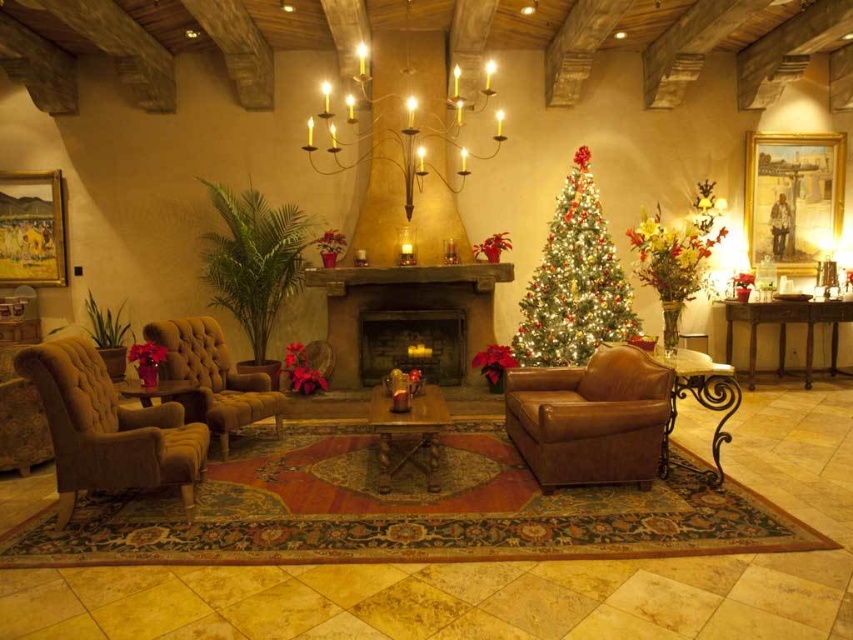
You are standing in the room and want to take a photo of the point at coordinates point (367, 352). The camera you are using has a maximum focus range of 6 meters. Will the camera be able to focus on the point?

The distance of point (367, 352) from camera is 6.62 meters, which exceeds the camera maximum focus range of 6 meters. Therefore, the camera will not be able to focus on the point.

You are a guest in this cozy Christmas living room and need to place a 1 meter long gift box between the brown leather couch at center and the wooden table at center. Is there enough space to fit the gift box between them?

The distance between the brown leather couch at center and the wooden table at center is 80.96 centimeters, which is shorter than the 1 meter long gift box. Therefore, there is not enough space to fit the gift box between them.